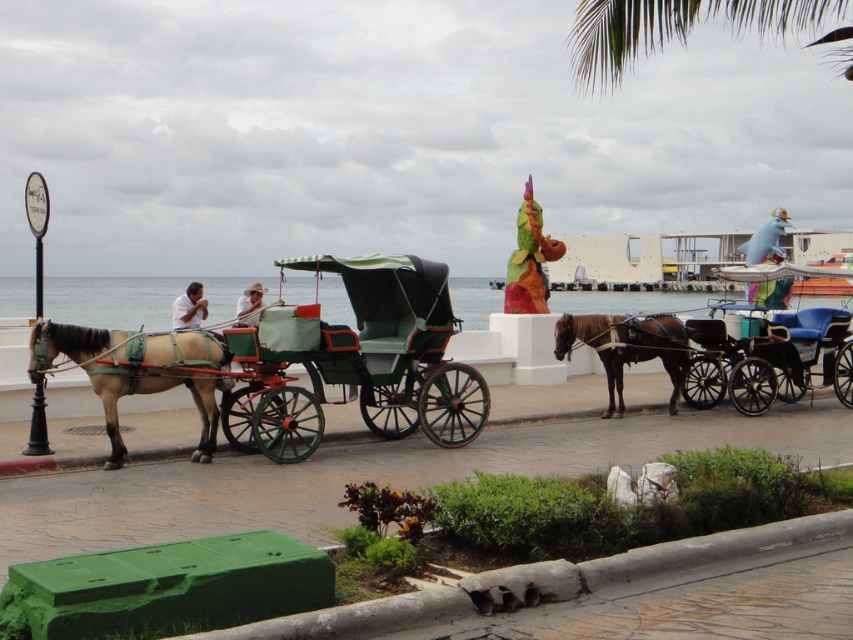
Between point (167, 380) and point (196, 320), which one is positioned in front?

Positioned in front is point (167, 380).

Between brown leather horse at left and matte green coach at center, which one has more height?

brown leather horse at left is taller.

Where is `brown leather horse at left`? Image resolution: width=853 pixels, height=640 pixels. brown leather horse at left is located at coordinates (134, 372).

Locate an element on the screen. This screenshot has height=640, width=853. brown leather horse at left is located at coordinates (134, 372).

Between green painted wood horse cart at center and blue leather cart at center, which one appears on the right side from the viewer's perspective?

From the viewer's perspective, blue leather cart at center appears more on the right side.

Describe the element at coordinates (302, 360) in the screenshot. This screenshot has height=640, width=853. I see `green painted wood horse cart at center` at that location.

Which is in front, point (299, 442) or point (843, 317)?

Point (299, 442) is in front.

Locate an element on the screen. This screenshot has width=853, height=640. green painted wood horse cart at center is located at coordinates (302, 360).

Can you confirm if green painted wood horse cart at center is bigger than brown leather horse at left?

Indeed, green painted wood horse cart at center has a larger size compared to brown leather horse at left.

Who is positioned more to the left, green painted wood horse cart at center or brown leather horse at left?

brown leather horse at left is more to the left.

Is point (230, 349) farther from camera compared to point (167, 378)?

Yes, it is.

This screenshot has height=640, width=853. I want to click on green painted wood horse cart at center, so click(302, 360).